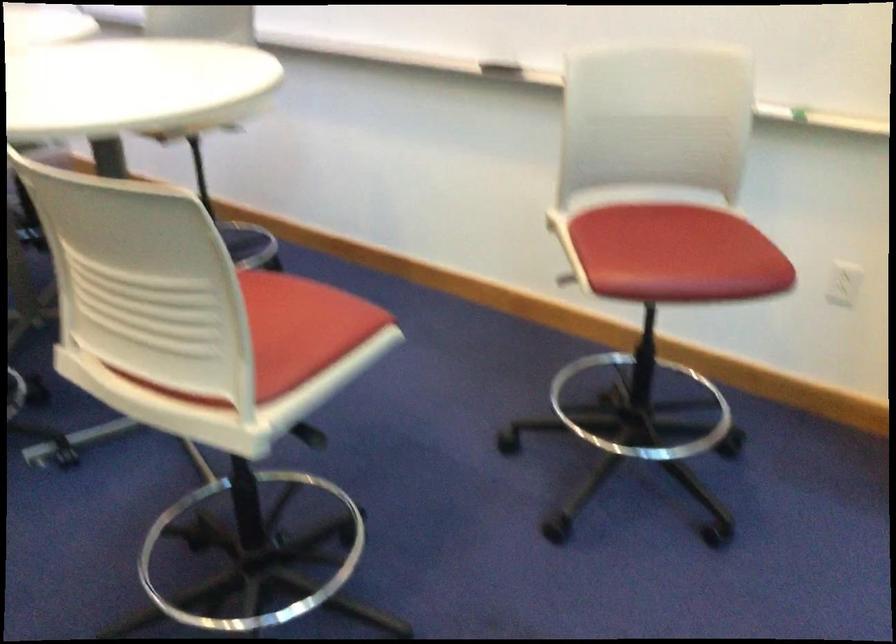
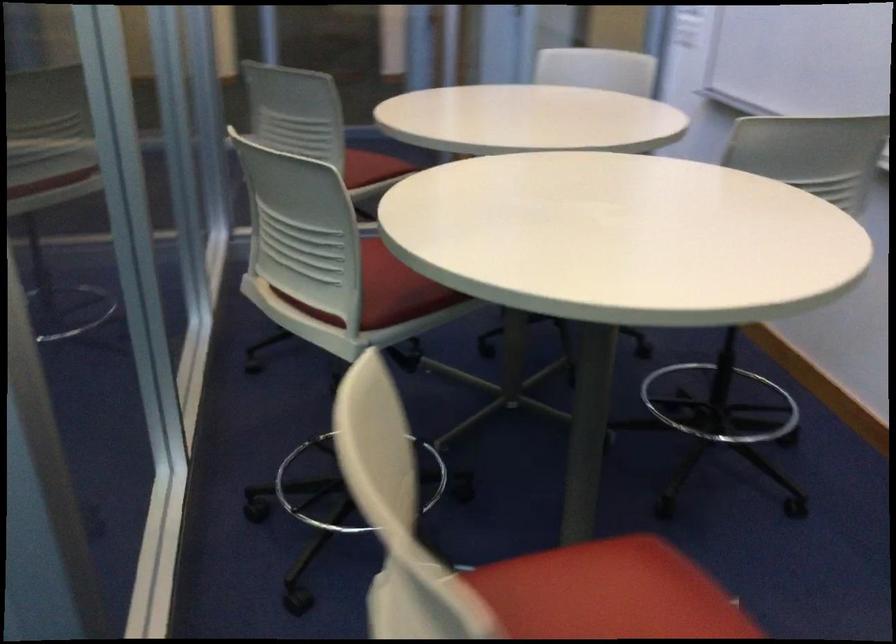
Question: The camera is either moving clockwise (left) or counter-clockwise (right) around the object. The first image is from the beginning of the video and the second image is from the end. Is the camera moving left or right when shooting the video?

Choices:
 (A) Left
 (B) Right

Answer: (B)